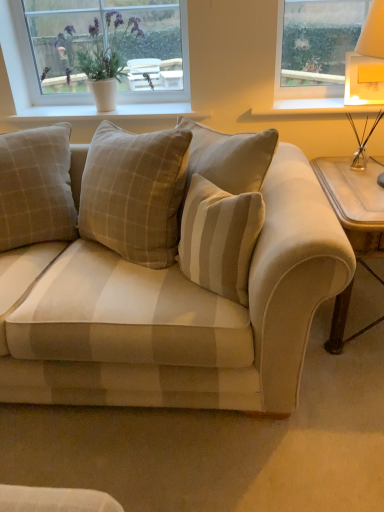
This screenshot has height=512, width=384. Find the location of `white painted wood at upper right`. white painted wood at upper right is located at coordinates (315, 106).

You are a GUI agent. You are given a task and a screenshot of the screen. Output one action in this format:
    pyautogui.click(x=<x>, y=<y>)
    Task: Click on the beige fabric couch at center
    This screenshot has width=384, height=512.
    Given the screenshot: What is the action you would take?
    pyautogui.click(x=175, y=281)

What do you see at coordinates (175, 281) in the screenshot?
I see `beige fabric couch at center` at bounding box center [175, 281].

Locate an element on the screen. This screenshot has height=512, width=384. white painted wood at upper right is located at coordinates click(315, 106).

Would you say beige fabric couch at center is a long distance from beige plaid pillow at center?

beige fabric couch at center is near beige plaid pillow at center, not far away.

From the image's perspective, is beige fabric couch at center over beige plaid pillow at center?

No, from the image's perspective, beige fabric couch at center is not above beige plaid pillow at center.

Is beige fabric couch at center situated inside beige plaid pillow at center or outside?

beige fabric couch at center is outside beige plaid pillow at center.

Considering the relative sizes of beige fabric couch at center and beige plaid pillow at center in the image provided, is beige fabric couch at center taller than beige plaid pillow at center?

Yes.

From the image's perspective, would you say white painted wood at upper right is shown under white textured window at upper left?

Yes.

Is white painted wood at upper right outside of white textured window at upper left?

Yes, white painted wood at upper right is not within white textured window at upper left.

Is white painted wood at upper right oriented towards white textured window at upper left?

No, white painted wood at upper right is not facing towards white textured window at upper left.

Is white painted wood at upper right to the left or to the right of white textured window at upper left in the image?

Clearly, white painted wood at upper right is on the right of white textured window at upper left in the image.

Considering the relative positions of wooden side table at right and beige fabric couch at center in the image provided, is wooden side table at right to the right of beige fabric couch at center from the viewer's perspective?

Indeed, wooden side table at right is positioned on the right side of beige fabric couch at center.

Would you say wooden side table at right contains beige fabric couch at center?

No, beige fabric couch at center is located outside of wooden side table at right.

Looking at this image, which is farther from the camera, (376, 194) or (180, 262)?

The point (376, 194) is farther from the camera.

From a real-world perspective, who is located higher, wooden side table at right or beige fabric couch at center?

beige fabric couch at center is physically above.

From a real-world perspective, is beige fabric couch at center positioned above or below white textured window at upper left?

Clearly, from a real-world perspective, beige fabric couch at center is below white textured window at upper left.

I want to click on window above the beige fabric couch at center (from the image's perspective), so click(x=17, y=63).

Is beige fabric couch at center at the right side of white textured window at upper left?

Yes.

Is beige fabric couch at center outside of white textured window at upper left?

Absolutely, beige fabric couch at center is external to white textured window at upper left.

Is point (19, 60) farther from camera compared to point (0, 205)?

That is True.

There is a beige plaid pillow at center. Find the location of `window above it (from a real-world perspective)`. window above it (from a real-world perspective) is located at coordinates (17, 63).

From a real-world perspective, between white textured window at upper left and beige plaid pillow at center, who is vertically higher?

white textured window at upper left.

Is white textured window at upper left turned away from beige plaid pillow at center?

No, beige plaid pillow at center is not at the back of white textured window at upper left.

Is wooden side table at right taller than white textured window at upper left?

Yes, wooden side table at right is taller than white textured window at upper left.

From the image's perspective, is wooden side table at right on white textured window at upper left?

No, from the image's perspective, wooden side table at right is not above white textured window at upper left.

Does point (113, 345) appear closer or farther from the camera than point (380, 104)?

Point (113, 345).

Can you confirm if beige fabric couch at center is smaller than white painted wood at upper right?

Actually, beige fabric couch at center might be larger than white painted wood at upper right.

Consider the image. Is beige fabric couch at center looking in the opposite direction of white painted wood at upper right?

Yes, beige fabric couch at center's orientation is away from white painted wood at upper right.

How many degrees apart are the facing directions of beige fabric couch at center and white painted wood at upper right?

The angle between the facing direction of beige fabric couch at center and the facing direction of white painted wood at upper right is 0.798 degrees.

This screenshot has width=384, height=512. What are the coordinates of `pillow lying on the left of beige fabric couch at center` in the screenshot? It's located at (36, 187).

Image resolution: width=384 pixels, height=512 pixels. What are the coordinates of `window sill on the right of white textured window at upper left` in the screenshot? It's located at (315, 106).

In the scene shown: Looking at the image, which one is located closer to white painted wood at upper right, beige fabric couch at center or wooden side table at right?

wooden side table at right lies closer to white painted wood at upper right than the other object.

When comparing their distances from beige plaid pillow at center, does white painted wood at upper right or white textured window at upper left seem closer?

white textured window at upper left is closer to beige plaid pillow at center.

Which object lies further to the anchor point white textured window at upper left, wooden side table at right or beige plaid pillow at center?

wooden side table at right lies further to white textured window at upper left than the other object.

Based on their spatial positions, is wooden side table at right or beige fabric couch at center closer to white textured window at upper left?

Among the two, beige fabric couch at center is located nearer to white textured window at upper left.

Which object lies further to the anchor point beige plaid pillow at center, white textured window at upper left or wooden side table at right?

Based on the image, wooden side table at right appears to be further to beige plaid pillow at center.

Looking at the image, which one is located further to beige fabric couch at center, white painted wood at upper right or white textured window at upper left?

white textured window at upper left is further to beige fabric couch at center.

Looking at the image, which one is located further to white painted wood at upper right, beige plaid pillow at center or beige fabric couch at center?

beige plaid pillow at center is positioned further to the anchor white painted wood at upper right.

From the image, which object appears to be nearer to white textured window at upper left, white painted wood at upper right or beige fabric couch at center?

white painted wood at upper right lies closer to white textured window at upper left than the other object.

Identify the location of studio couch located between beige plaid pillow at center and wooden side table at right in the left-right direction. (175, 281).

Identify the location of window sill between white textured window at upper left and wooden side table at right from left to right. (315, 106).

Locate an element on the screen. The image size is (384, 512). window between beige plaid pillow at center and wooden side table at right is located at coordinates pyautogui.click(x=17, y=63).

What are the coordinates of `studio couch situated between beige plaid pillow at center and white painted wood at upper right from left to right` in the screenshot? It's located at (175, 281).